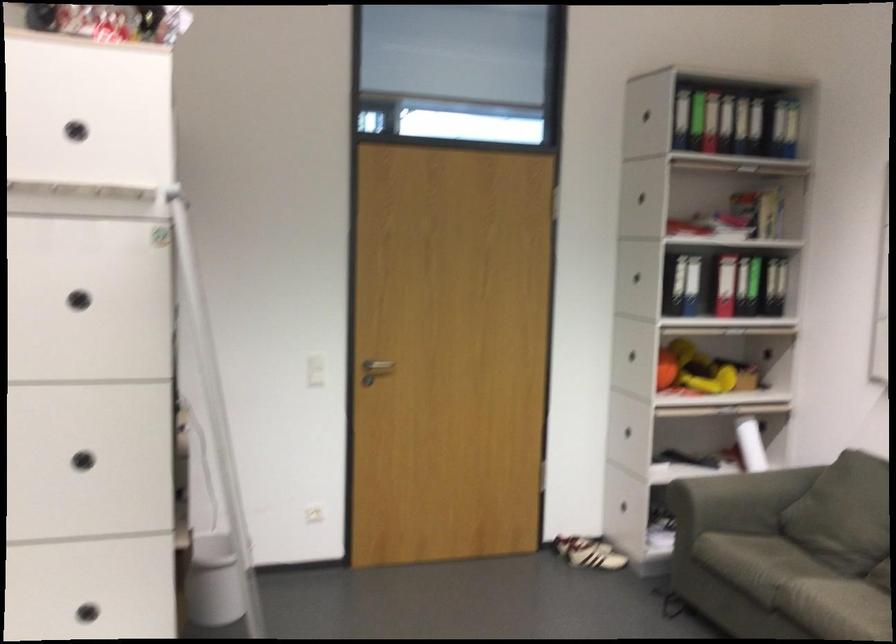
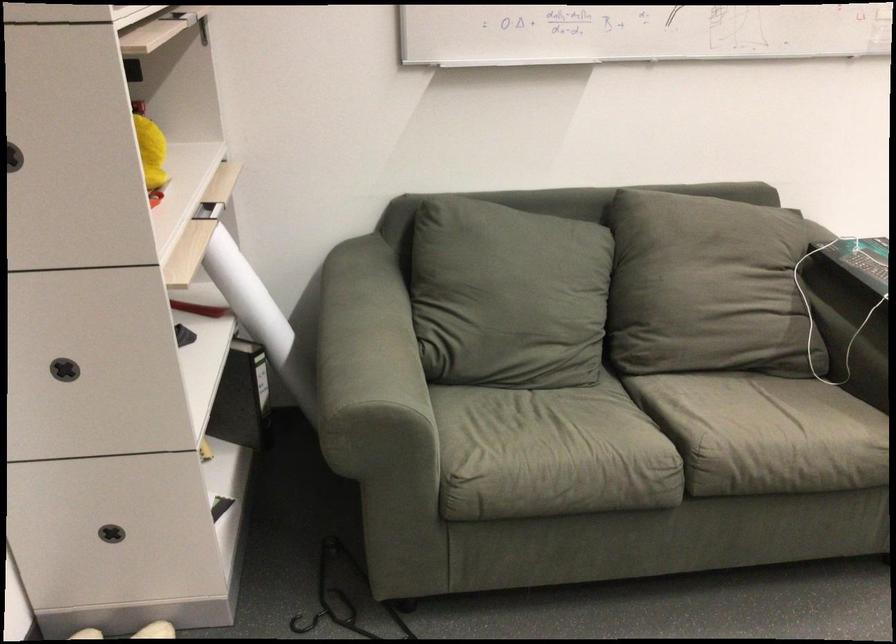
The point at (719, 474) is marked in the first image. Where is the corresponding point in the second image?

(358, 342)